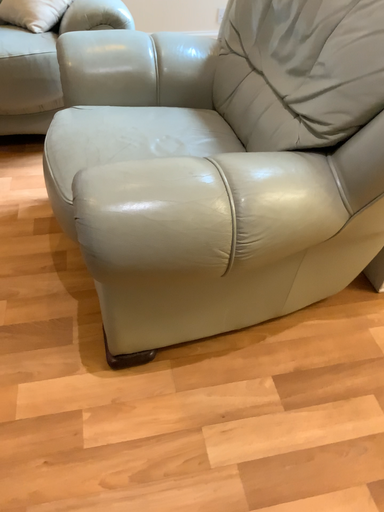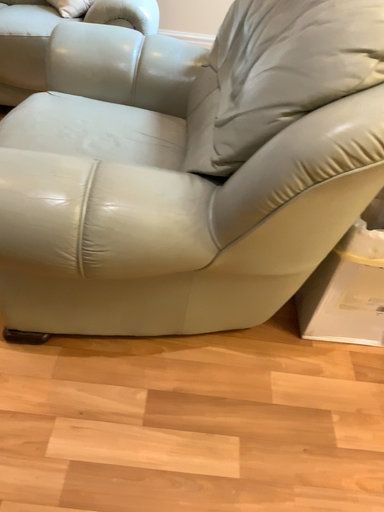
Question: Which way did the camera rotate in the video?

Choices:
 (A) rotated left
 (B) rotated right

Answer: (A)